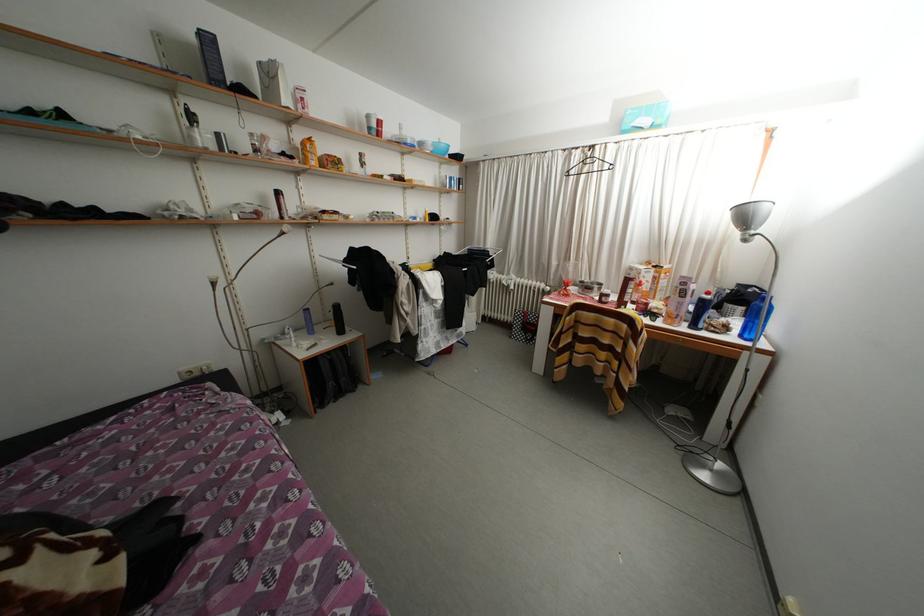
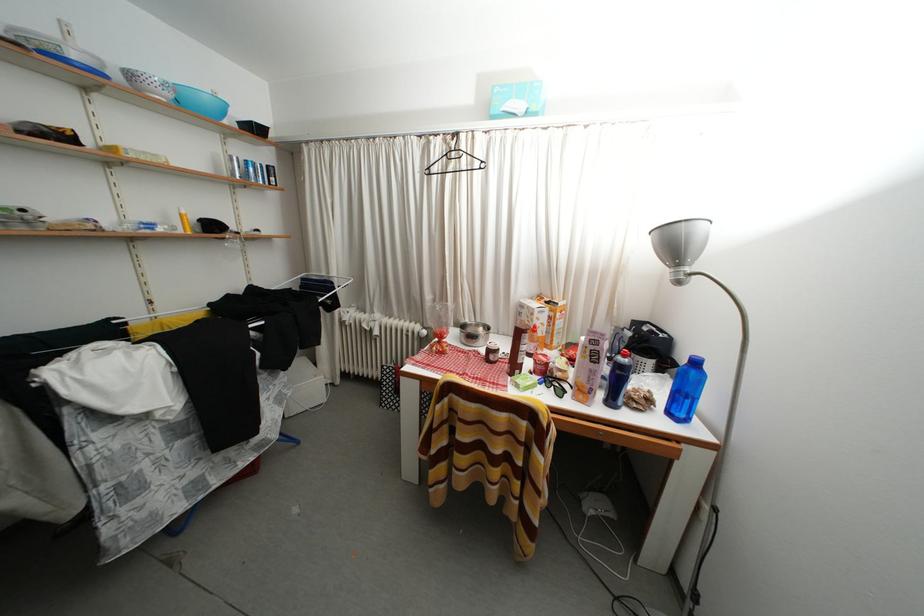
Where in the second image is the point corresponding to the point at 580,294 from the first image?

(460, 342)